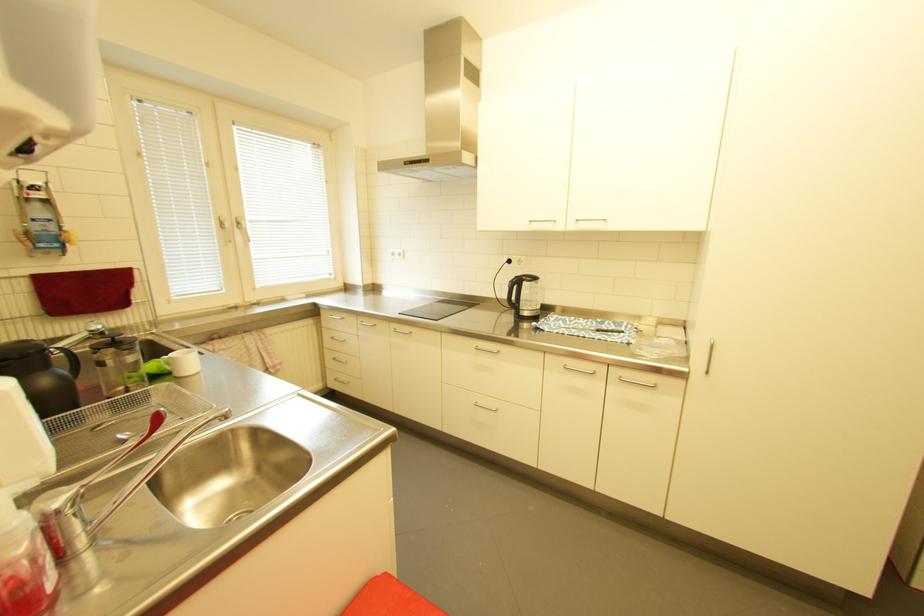
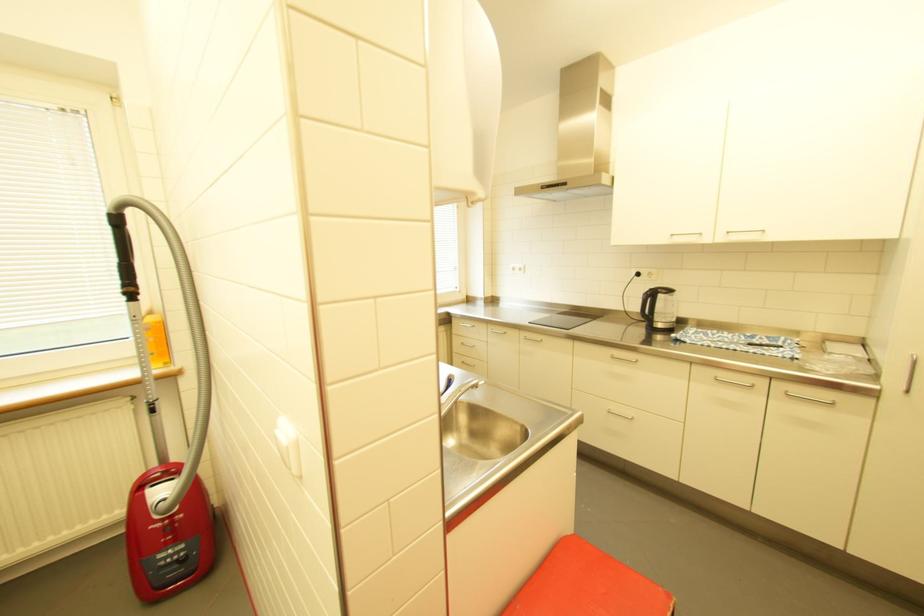
Find the pixel in the second image that matches point (530, 227) in the first image.

(671, 241)